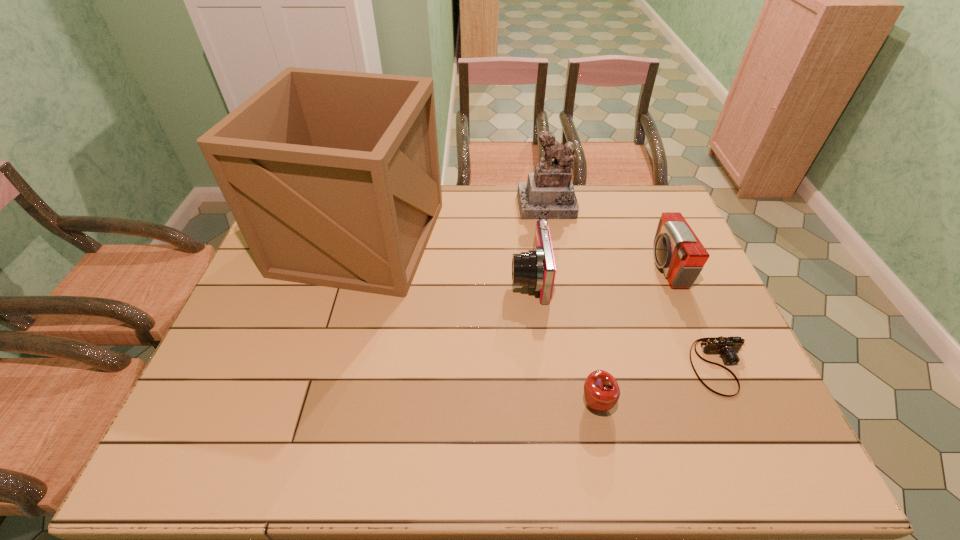
The height and width of the screenshot is (540, 960). What are the coordinates of `free space at the left edge of the desktop` in the screenshot? It's located at (283, 353).

Find the location of `free space at the right edge of the desktop`. free space at the right edge of the desktop is located at coordinates (639, 235).

The width and height of the screenshot is (960, 540). In order to click on vacant space at the far right corner in this screenshot , I will do `click(619, 195)`.

I want to click on unoccupied position between the second shortest object and the figurine, so click(x=572, y=305).

The width and height of the screenshot is (960, 540). Identify the location of vacant area that lies between the leftmost camera and the fifth tallest object. (563, 341).

Where is `unoccupied position between the figurine and the apple`? unoccupied position between the figurine and the apple is located at coordinates (572, 305).

Find the location of a particular element. free spot between the box and the leftmost camera is located at coordinates (444, 258).

The width and height of the screenshot is (960, 540). I want to click on vacant space that is in between the box and the second shortest object, so click(478, 321).

Where is `free space between the figurine and the leftmost object`? The height and width of the screenshot is (540, 960). free space between the figurine and the leftmost object is located at coordinates (454, 222).

Locate an element on the screen. This screenshot has height=540, width=960. free space that is in between the leftmost object and the shortest camera is located at coordinates (540, 302).